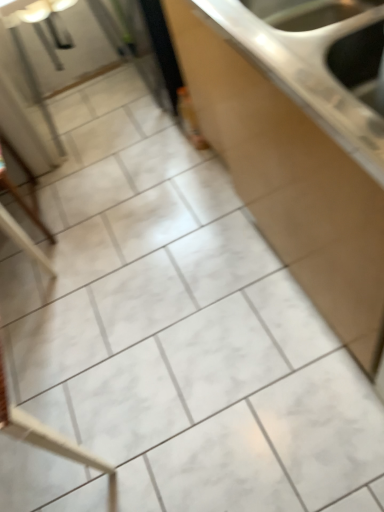
The width and height of the screenshot is (384, 512). What do you see at coordinates (290, 180) in the screenshot?
I see `white glossy countertop at center` at bounding box center [290, 180].

Where is `white glossy countertop at center`? white glossy countertop at center is located at coordinates (290, 180).

Describe the element at coordinates (24, 240) in the screenshot. I see `wooden chair at left` at that location.

At what (x,y) coordinates should I click in order to perform the action: click on wooden chair at left. Please return your answer as a coordinate pair (x, y). This screenshot has width=384, height=512. Looking at the image, I should click on (24, 240).

At what (x,y) coordinates should I click in order to perform the action: click on white glossy countertop at center. Please return your answer as a coordinate pair (x, y). Looking at the image, I should click on (290, 180).

Which is more to the left, wooden chair at left or white glossy countertop at center?

wooden chair at left is more to the left.

Which object is closer to the camera, wooden chair at left or white glossy countertop at center?

white glossy countertop at center.

Does point (11, 228) appear closer or farther from the camera than point (298, 186)?

Point (11, 228) is positioned farther from the camera compared to point (298, 186).

From the image's perspective, is wooden chair at left located above white glossy countertop at center?

No, from the image's perspective, wooden chair at left is not over white glossy countertop at center.

From a real-world perspective, does wooden chair at left stand above white glossy countertop at center?

Incorrect, from a real-world perspective, wooden chair at left is lower than white glossy countertop at center.

In the scene shown: Between wooden chair at left and white glossy countertop at center, which one has smaller width?

white glossy countertop at center.

From their relative heights in the image, would you say wooden chair at left is taller or shorter than white glossy countertop at center?

Clearly, wooden chair at left is shorter compared to white glossy countertop at center.

In terms of size, does wooden chair at left appear bigger or smaller than white glossy countertop at center?

Considering their sizes, wooden chair at left takes up less space than white glossy countertop at center.

Is wooden chair at left not within white glossy countertop at center?

wooden chair at left lies outside white glossy countertop at center's area.

Looking at this image, is wooden chair at left in contact with white glossy countertop at center?

No, wooden chair at left is not beside white glossy countertop at center.

Could you tell me if wooden chair at left is turned towards white glossy countertop at center?

No, wooden chair at left is not oriented towards white glossy countertop at center.

How far apart are wooden chair at left and white glossy countertop at center?

36.26 inches.

You are a GUI agent. You are given a task and a screenshot of the screen. Output one action in this format:
    pyautogui.click(x=<x>, y=<y>)
    Task: Click on the countertop above the wooden chair at left (from a real-world perspective)
    
    Given the screenshot: What is the action you would take?
    pyautogui.click(x=290, y=180)

Based on the photo, is white glossy countertop at center at the left side of wooden chair at left?

No.

Which object is closer to the camera, white glossy countertop at center or wooden chair at left?

Positioned in front is white glossy countertop at center.

Which point is more forward, (x=235, y=116) or (x=25, y=250)?

Positioned in front is point (x=235, y=116).

From the image's perspective, between white glossy countertop at center and wooden chair at left, which one is located above?

white glossy countertop at center appears higher in the image.

From a real-world perspective, is white glossy countertop at center beneath wooden chair at left?

No, from a real-world perspective, white glossy countertop at center is not below wooden chair at left.

Which object is thinner, white glossy countertop at center or wooden chair at left?

Thinner between the two is white glossy countertop at center.

Considering the relative sizes of white glossy countertop at center and wooden chair at left in the image provided, is white glossy countertop at center taller than wooden chair at left?

Indeed, white glossy countertop at center has a greater height compared to wooden chair at left.

Can you confirm if white glossy countertop at center is smaller than wooden chair at left?

No, white glossy countertop at center is not smaller than wooden chair at left.

Is white glossy countertop at center situated inside wooden chair at left or outside?

white glossy countertop at center lies outside wooden chair at left.

Is white glossy countertop at center with wooden chair at left?

No, white glossy countertop at center is not next to wooden chair at left.

Is white glossy countertop at center aimed at wooden chair at left?

Yes, white glossy countertop at center faces towards wooden chair at left.

Can you tell me how much white glossy countertop at center and wooden chair at left differ in facing direction?

The angular difference between white glossy countertop at center and wooden chair at left is 91.8 degrees.

The image size is (384, 512). In order to click on countertop located above the wooden chair at left (from a real-world perspective) in this screenshot , I will do `click(290, 180)`.

In the image, there is a white glossy countertop at center. Identify the location of furniture below it (from a real-world perspective). This screenshot has width=384, height=512. (24, 240).

The image size is (384, 512). I want to click on furniture to the left of white glossy countertop at center, so click(24, 240).